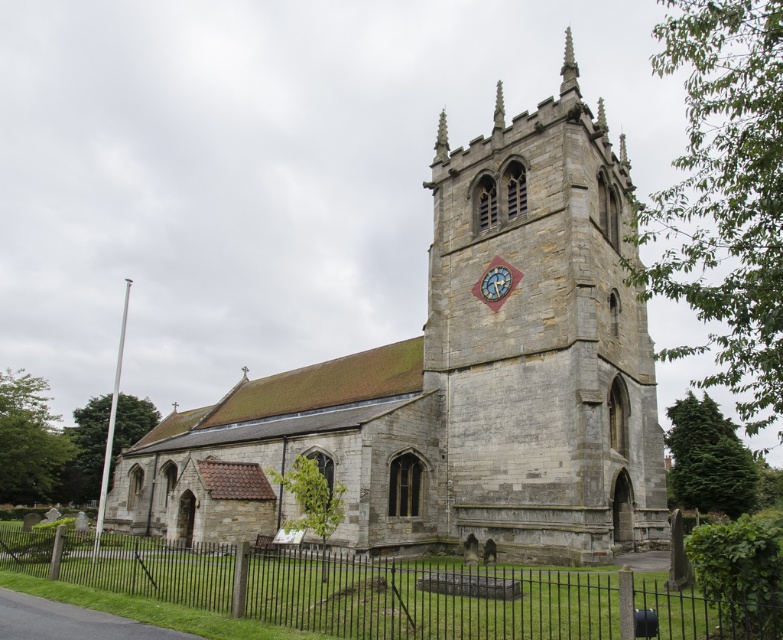
Question: Is gray stone church at center to the left of gray stone clock tower at center from the viewer's perspective?

Choices:
 (A) no
 (B) yes

Answer: (B)

Question: Among these points, which one is nearest to the camera?

Choices:
 (A) (565, 81)
 (B) (594, 323)
 (C) (13, 560)

Answer: (B)

Question: Which point appears closest to the camera in this image?

Choices:
 (A) (498, 182)
 (B) (42, 544)
 (C) (450, 547)

Answer: (B)

Question: Is black wrought iron fence at lower center positioned behind stone spire at upper center?

Choices:
 (A) no
 (B) yes

Answer: (A)

Question: Which object is positioned farthest from the black wrought iron fence at lower center?

Choices:
 (A) stone spire at upper center
 (B) blue painted wood clock at upper right
 (C) gray stone clock tower at center
 (D) gray stone church at center

Answer: (A)

Question: Considering the relative positions of stone spire at upper center and stone steeple at upper center in the image provided, where is stone spire at upper center located with respect to stone steeple at upper center?

Choices:
 (A) below
 (B) above

Answer: (B)